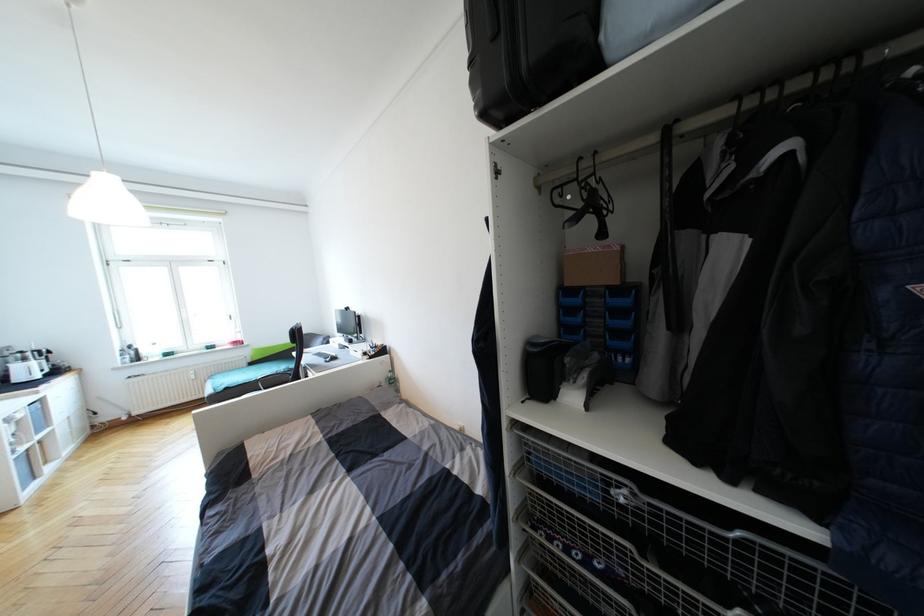
The image size is (924, 616). Find the location of `cardboard box`. cardboard box is located at coordinates (596, 248).